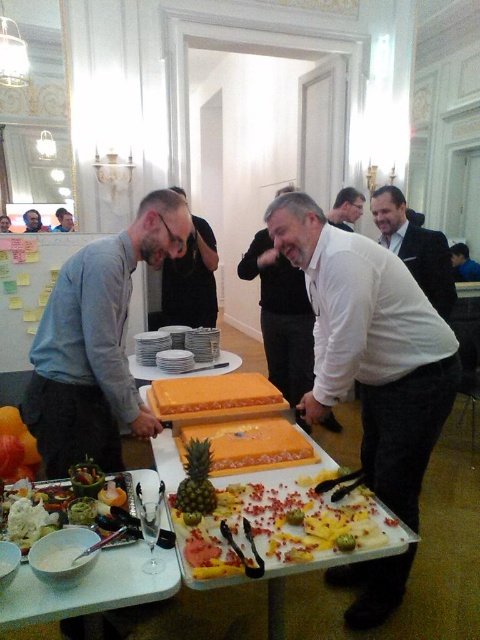
You are standing in the room and see two points marked in the scene. Which point is closer to you, point (249, 278) or point (352, 227)?

Point (249, 278) is in front of point (352, 227), so it is closer to you.

You are a photographer at the event and need to capture a closeup of the white glossy plates at center without the white matte shirt at center blocking the view. Is this possible given their positions?

The white matte shirt at center is taller than the white glossy plates at center, so it may block the view. Adjust the camera angle or move closer to ensure the plates are visible without obstruction.

You are standing in the room and want to take a photo of both the gray shirt at center and the smooth skin face at upper left. Which object should you focus on first to ensure both are in clear view?

The gray shirt at center is closer to the viewer than the smooth skin face at upper left, so focus on the gray shirt at center first to ensure both are in clear view.